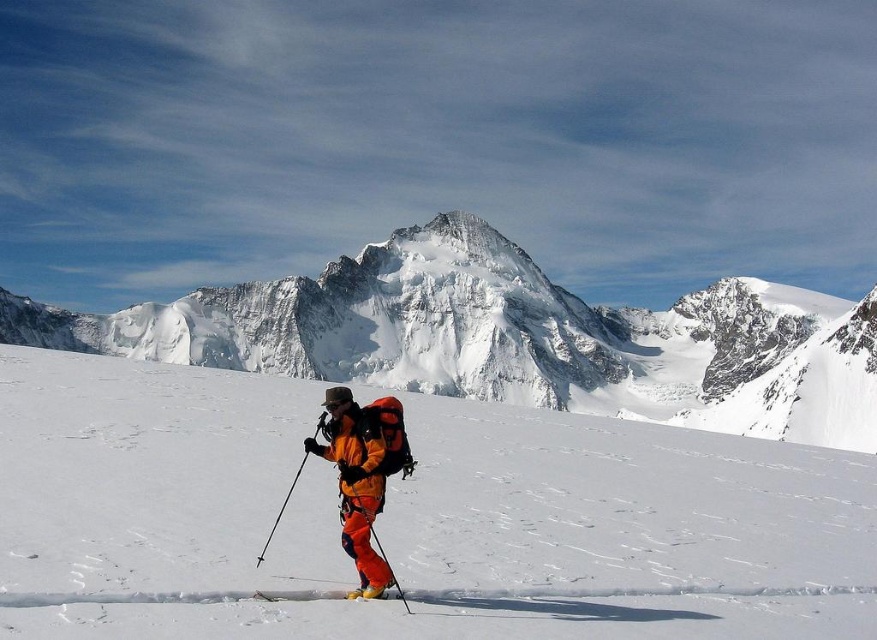
Is orange fabric ski slope at center shorter than orange fabric jacket at center?

No.

Can you confirm if orange fabric ski slope at center is positioned to the left of orange fabric jacket at center?

Incorrect, orange fabric ski slope at center is not on the left side of orange fabric jacket at center.

Which is in front, point (276, 400) or point (386, 580)?

Positioned in front is point (386, 580).

You are a GUI agent. You are given a task and a screenshot of the screen. Output one action in this format:
    pyautogui.click(x=<x>, y=<y>)
    Task: Click on the orange fabric ski slope at center
    This screenshot has height=640, width=877.
    Given the screenshot: What is the action you would take?
    pyautogui.click(x=408, y=518)

Between orange fabric ski slope at center and matte orange ski at center, which one appears on the left side from the viewer's perspective?

From the viewer's perspective, matte orange ski at center appears more on the left side.

Which of these two, orange fabric ski slope at center or matte orange ski at center, stands taller?

orange fabric ski slope at center

Identify the location of orange fabric ski slope at center. The width and height of the screenshot is (877, 640). (408, 518).

This screenshot has width=877, height=640. What are the coordinates of `orange fabric ski slope at center` in the screenshot? It's located at (408, 518).

Who is more distant from viewer, (362, 564) or (398, 595)?

Point (362, 564)

Can you confirm if orange fabric jacket at center is positioned to the left of orange plastic ski pole at center?

Correct, you'll find orange fabric jacket at center to the left of orange plastic ski pole at center.

At what (x,y) coordinates should I click in order to perform the action: click on orange fabric jacket at center. Please return your answer as a coordinate pair (x, y). The image size is (877, 640). Looking at the image, I should click on (355, 483).